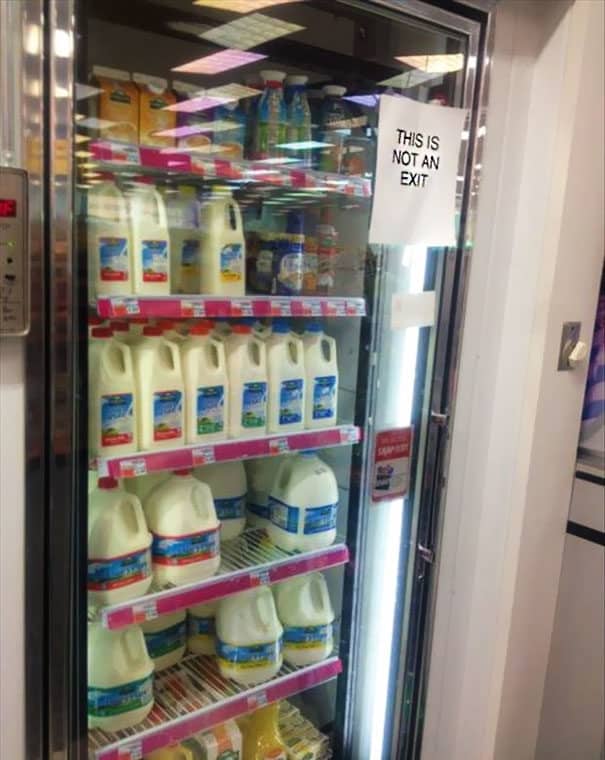
Where is `visible shelves`? This screenshot has height=760, width=605. visible shelves is located at coordinates (266, 172), (253, 304), (243, 447), (238, 575), (238, 704).